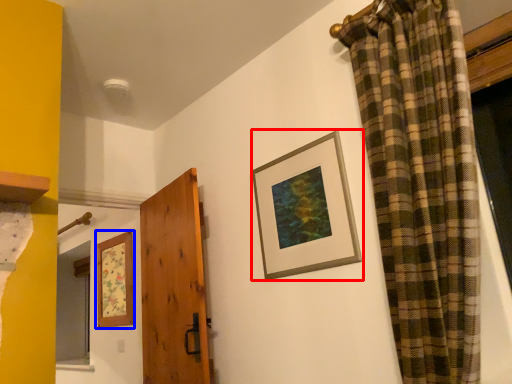
Question: Which object appears farthest to the camera in this image, picture frame (highlighted by a red box) or picture frame (highlighted by a blue box)?

Choices:
 (A) picture frame
 (B) picture frame

Answer: (B)